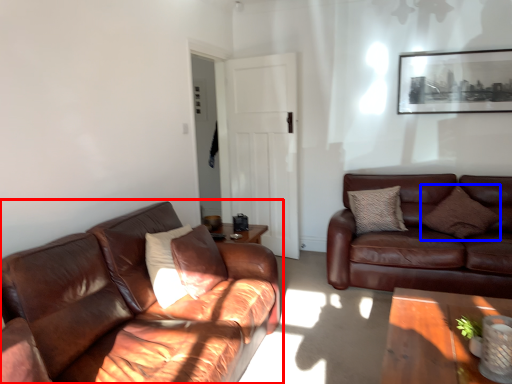
Question: Among these objects, which one is nearest to the camera, studio couch (highlighted by a red box) or pillow (highlighted by a blue box)?

Choices:
 (A) studio couch
 (B) pillow

Answer: (A)